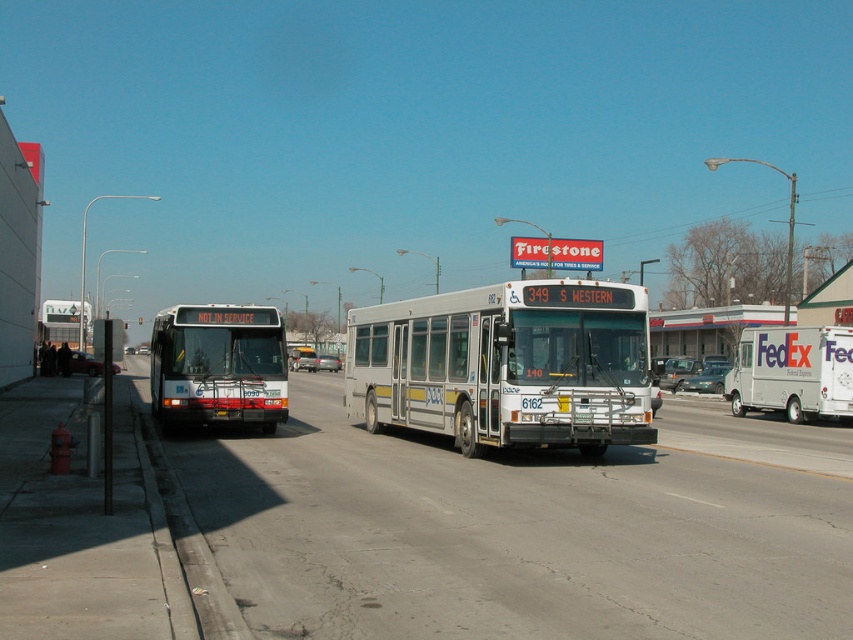
You are a pedestrian standing on the sidewalk and want to cross the street to reach the white matte bus at center. Is the white metallic bus at center blocking your path?

The white metallic bus at center is located below the white matte bus at center, so it is positioned in front of it. This means the white metallic bus at center is blocking your path to the white matte bus at center.